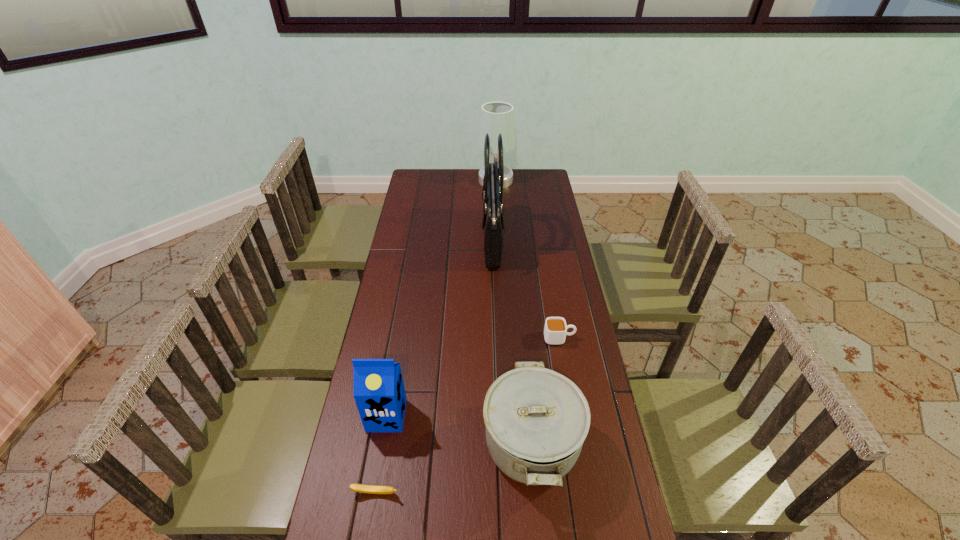
Identify the location of free location that satisfies the following two spatial constraints: 1. on the side with the handle of the cup; 2. on the front side of the saucepan. Image resolution: width=960 pixels, height=540 pixels. (578, 444).

Find the location of a particular element. vacant space that satisfies the following two spatial constraints: 1. on the base of the lampshade; 2. on the left side of the fourth tallest object is located at coordinates (510, 444).